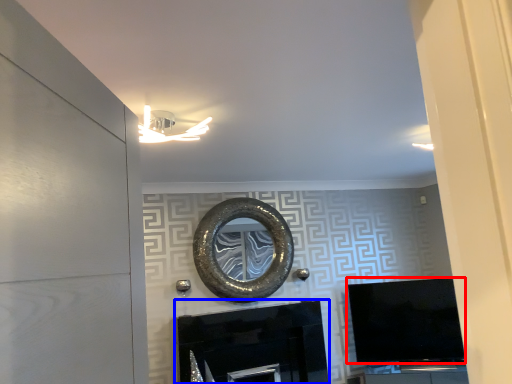
Question: Which object is further to the camera taking this photo, television (highlighted by a red box) or fireplace (highlighted by a blue box)?

Choices:
 (A) television
 (B) fireplace

Answer: (A)